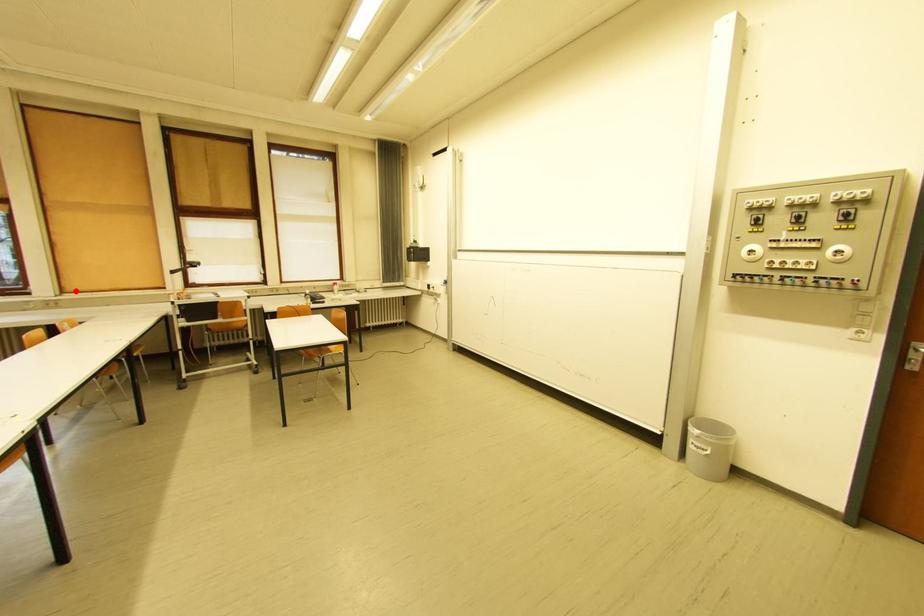
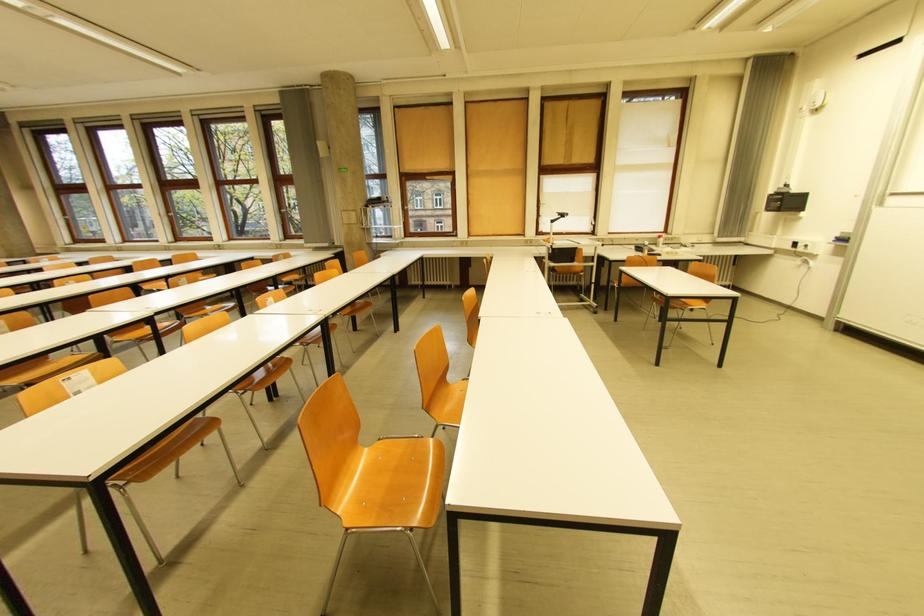
Question: I am providing you with two images of the same scene from different viewpoints. In image1, a red point is highlighted. Considering the same 3D point in image2, which of the following is correct?

Choices:
 (A) It is closer
 (B) It is farther

Answer: (A)